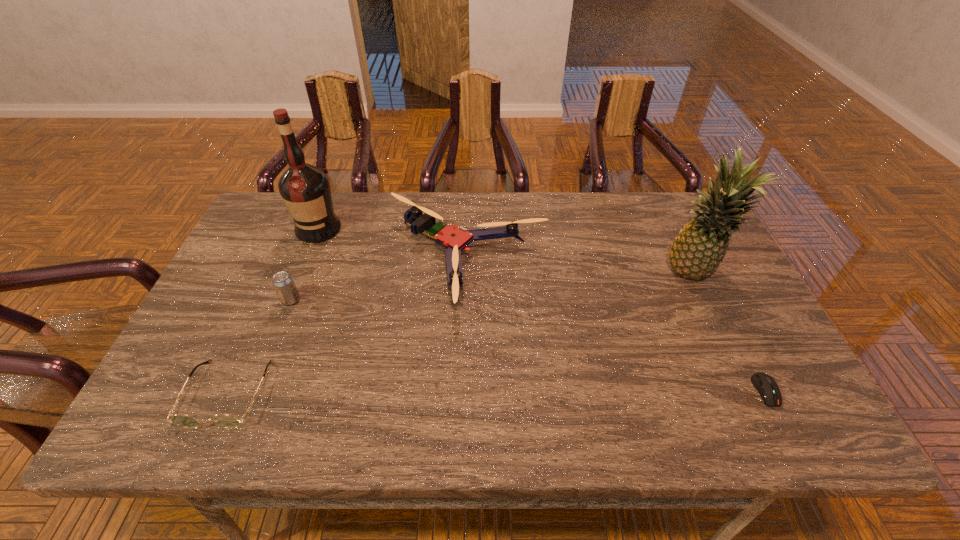
Find the location of `liquor that is at the far edge`. liquor that is at the far edge is located at coordinates (305, 189).

Find the location of a particular element. This screenshot has width=960, height=540. drone that is at the far edge is located at coordinates (455, 239).

This screenshot has height=540, width=960. In order to click on spectacles that is at the near edge in this screenshot , I will do `click(226, 421)`.

Identify the location of computer equipment at the near edge. This screenshot has height=540, width=960. (767, 387).

Find the location of a particular element. The image size is (960, 540). liquor located at the left edge is located at coordinates (305, 189).

Find the location of a particular element. This screenshot has height=540, width=960. spectacles that is at the left edge is located at coordinates (226, 421).

Locate an element on the screen. The width and height of the screenshot is (960, 540). pineapple present at the right edge is located at coordinates tap(698, 249).

At what (x,y) coordinates should I click in order to perform the action: click on computer equipment that is at the right edge. Please return your answer as a coordinate pair (x, y). Image resolution: width=960 pixels, height=540 pixels. Looking at the image, I should click on (767, 387).

Image resolution: width=960 pixels, height=540 pixels. In order to click on object that is at the far left corner in this screenshot , I will do `click(305, 189)`.

Where is `object at the near left corner`? object at the near left corner is located at coordinates (226, 421).